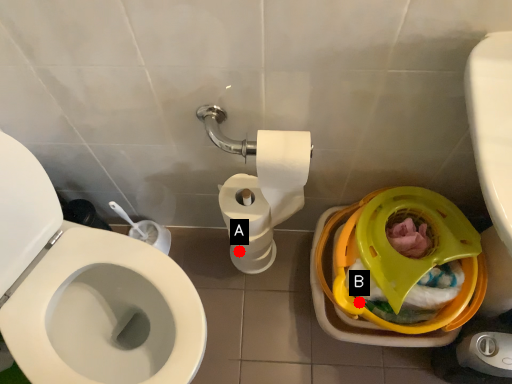
Question: Two points are circled on the image, labeled by A and B beside each circle. Which point appears closest to the camera in this image?

Choices:
 (A) A is closer
 (B) B is closer

Answer: (B)